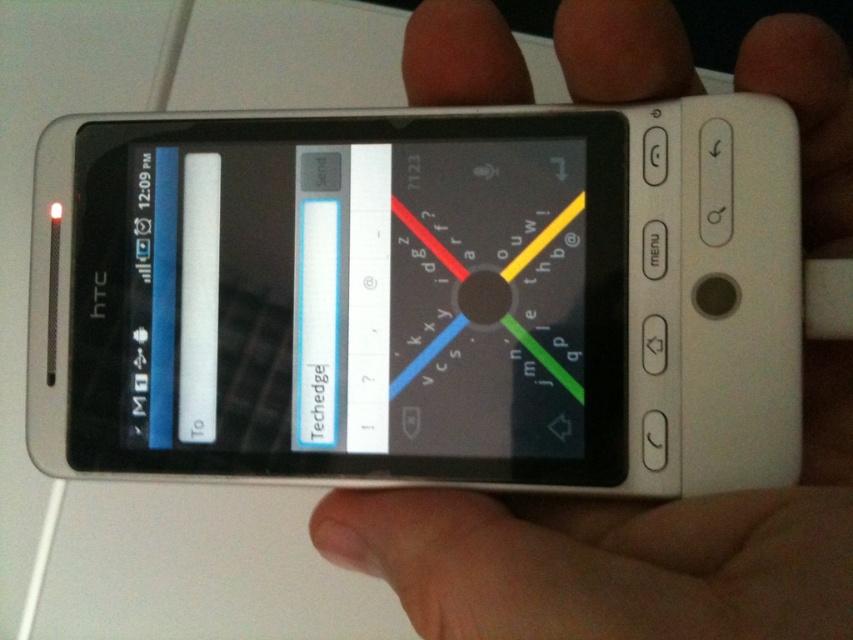
You are trying to locate the HTC smartphone in the image. According to the coordinates provided, where exactly is the satin white phone at center positioned?

The satin white phone at center is positioned at coordinates point (352, 298).

You are trying to determine if the satin white phone at center can fit into a pocket that is the same size as the white matte hand at center. Based on the scene, will it fit?

The satin white phone at center has a smaller size compared to white matte hand at center, so it will fit into a pocket of the same size as the white matte hand at center.

Looking at this image, you are trying to locate the point at coordinates (352, 298) on the HTC smartphone shown in the image. Based on the description provided, where would this point be located?

The point at coordinates (352, 298) is on the satin white phone at center.